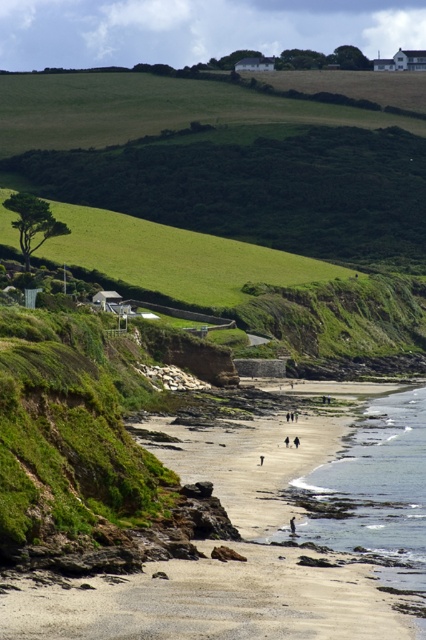
Which is behind, point (336, 445) or point (400, 476)?

Positioned behind is point (336, 445).

Can you confirm if smooth sand beach at center is positioned above clear water at beach center?

Yes, smooth sand beach at center is above clear water at beach center.

Which is in front, point (405, 630) or point (359, 483)?

Point (405, 630)

Identify the location of smooth sand beach at center. The width and height of the screenshot is (426, 640). (230, 547).